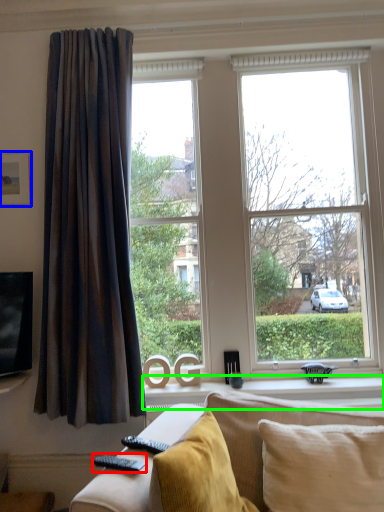
Question: Which object is positioned closest to remote (highlighted by a red box)? Select from picture frame (highlighted by a blue box) and window sill (highlighted by a green box).

Choices:
 (A) picture frame
 (B) window sill

Answer: (B)